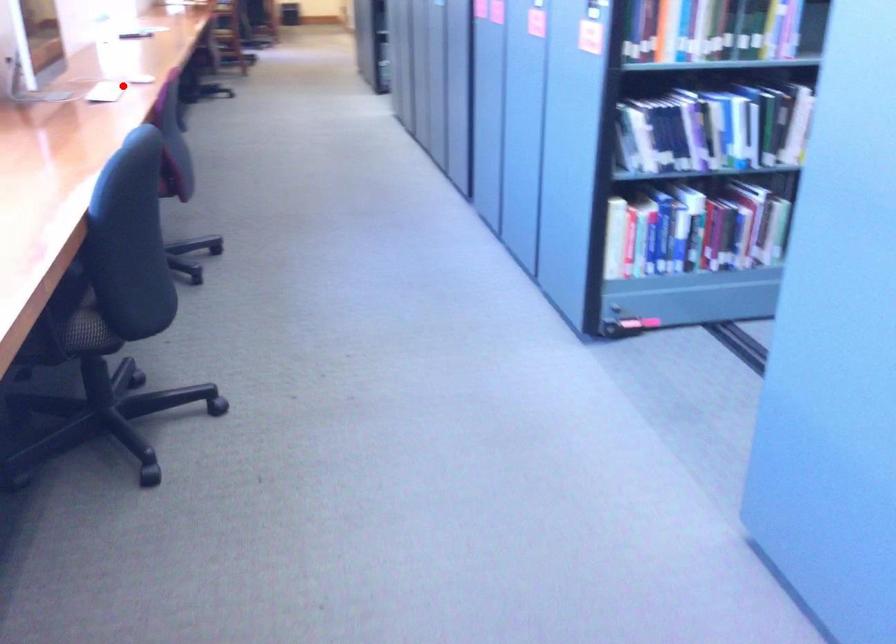
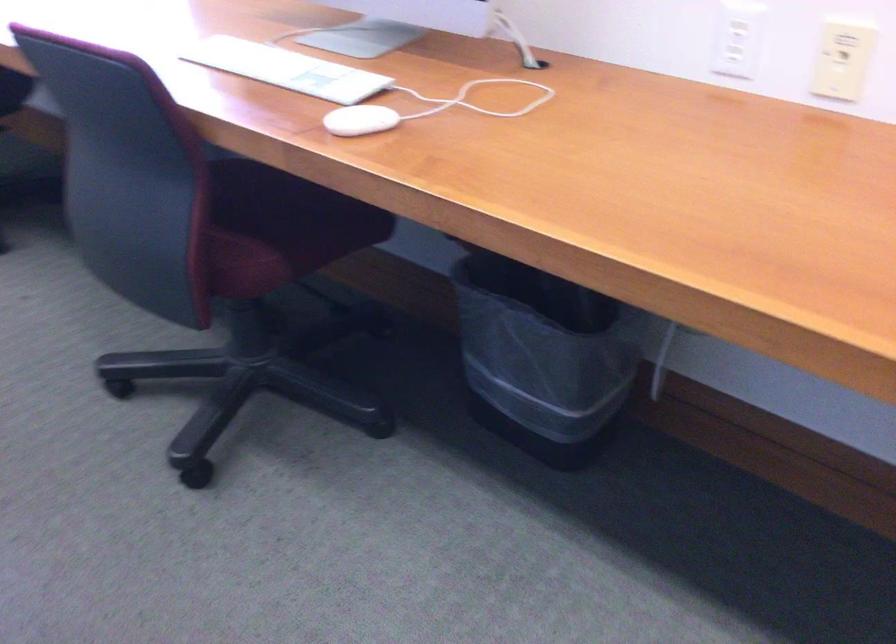
Question: I am providing you with two images of the same scene from different viewpoints. In image1, a red point is highlighted. Considering the same 3D point in image2, which of the following is correct?

Choices:
 (A) It is closer
 (B) It is farther

Answer: (A)